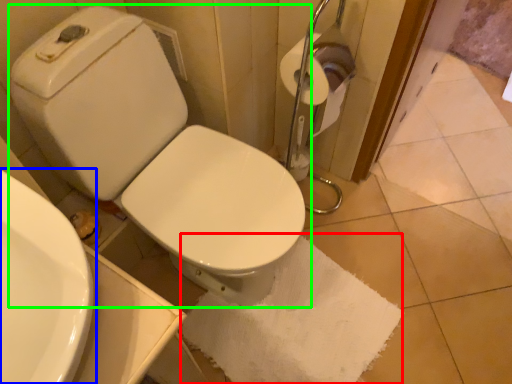
Question: Which object is positioned farthest from bath towel (highlighted by a red box)? Select from sink (highlighted by a blue box) and toilet (highlighted by a green box).

Choices:
 (A) sink
 (B) toilet

Answer: (A)